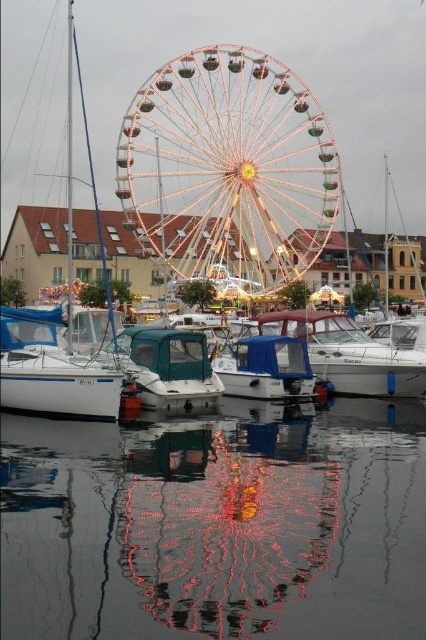
Does glossy reflective water at lower center have a lesser width compared to teal matte boat at center?

No, glossy reflective water at lower center is not thinner than teal matte boat at center.

Locate an element on the screen. This screenshot has width=426, height=640. glossy reflective water at lower center is located at coordinates (216, 524).

Can you confirm if white glossy sailboat at left is positioned above teal matte boat at center?

Yes.

Is white glossy sailboat at left below teal matte boat at center?

Actually, white glossy sailboat at left is above teal matte boat at center.

Who is more distant from viewer, (86, 374) or (129, 355)?

The point (129, 355) is more distant.

Identify the location of white glossy sailboat at left. (54, 339).

Does glossy reflective water at lower center have a greater width compared to blue matte boat at center?

Yes.

Is glossy reflective water at lower center taller than blue matte boat at center?

Yes.

What do you see at coordinates (216, 524) in the screenshot?
I see `glossy reflective water at lower center` at bounding box center [216, 524].

Where is `glossy reflective water at lower center`? The height and width of the screenshot is (640, 426). glossy reflective water at lower center is located at coordinates (216, 524).